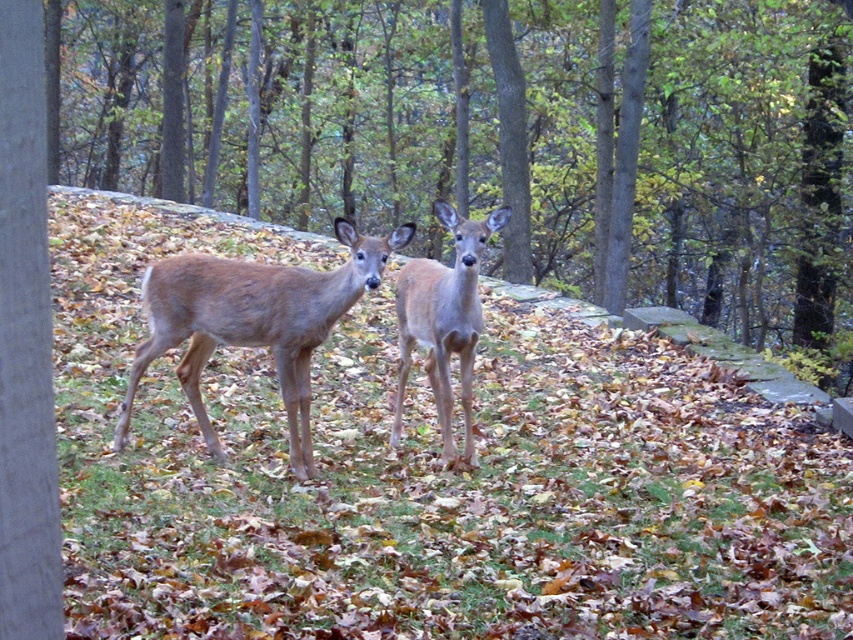
There are two brown fur deer at center in the scene. How far apart are they from each other?

The two brown fur deer at center are 13.47 meters apart.

You are a wildlife photographer trying to capture both the brown fur deer at center and the light brown fur at center in a single frame. Based on their positions, which deer do you think might require you to adjust your camera angle to include both in the shot?

The brown fur deer at center might be wider than light brown fur at center, so you might need to adjust your camera angle to ensure both are fully captured in the frame.